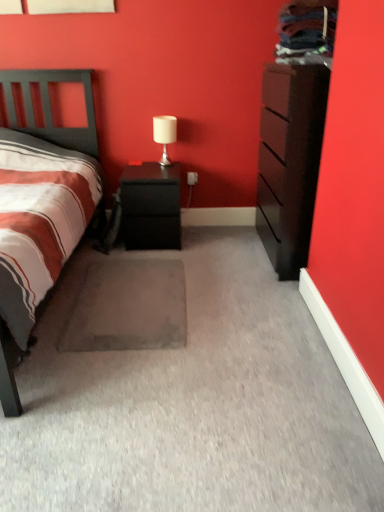
You are a GUI agent. You are given a task and a screenshot of the screen. Output one action in this format:
    pyautogui.click(x=<x>, y=<y>)
    Task: Click on the vacant region to the right of black matte nightstand at center
    The image size is (384, 512).
    Given the screenshot: What is the action you would take?
    pyautogui.click(x=208, y=240)